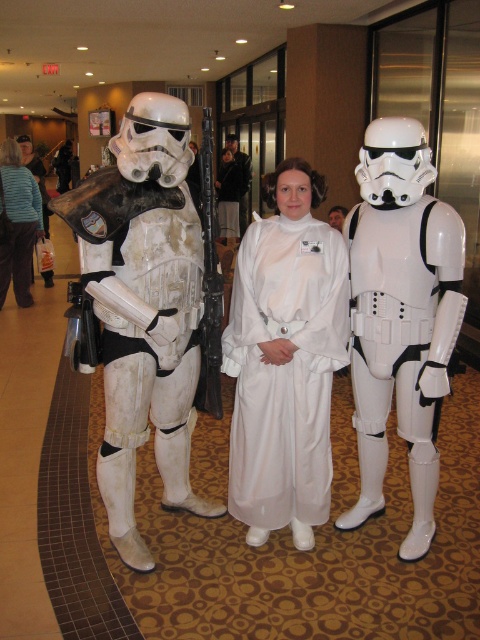
Question: Which point is farther to the camera?

Choices:
 (A) white satin dress at center
 (B) matte black jacket at left

Answer: (B)

Question: Does white satin dress at center appear on the right side of matte black jacket at left?

Choices:
 (A) yes
 (B) no

Answer: (A)

Question: Which point appears closest to the camera in this image?

Choices:
 (A) (99, 236)
 (B) (228, 225)
 (C) (310, 401)

Answer: (A)

Question: Which point is closer to the camera taking this photo?

Choices:
 (A) (37, 176)
 (B) (104, 340)
 (C) (296, 284)
 (D) (354, 308)

Answer: (C)

Question: Does white matte stormtrooper armor at left have a greater width compared to white matte stormtrooper armor at right?

Choices:
 (A) yes
 (B) no

Answer: (A)

Question: Is the position of white matte stormtrooper armor at left less distant than that of white satin dress at center?

Choices:
 (A) yes
 (B) no

Answer: (A)